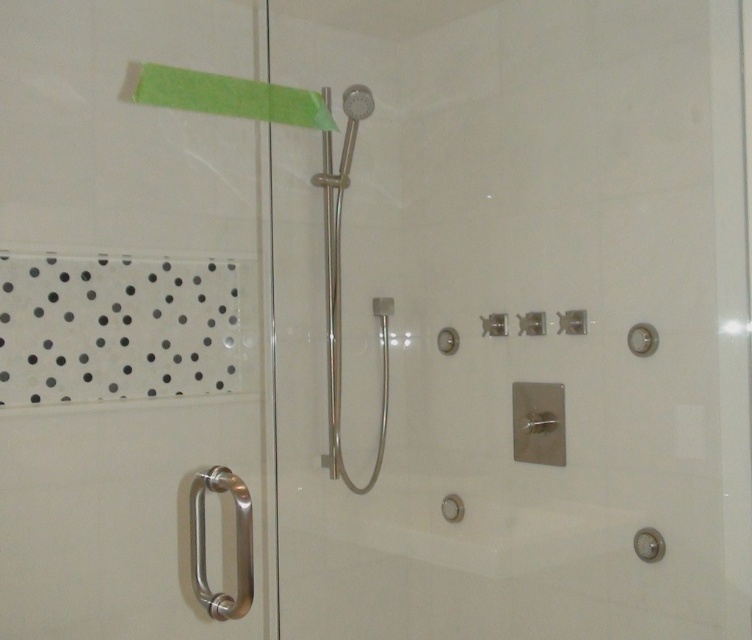
What are the coordinates of `polished chrome shower head at center` in the screenshot? It's located at (340, 307).

Can you confirm if polished chrome shower head at center is taller than satin nickel showerhead at upper center?

Yes, polished chrome shower head at center is taller than satin nickel showerhead at upper center.

Who is more distant from viewer, (326, 177) or (350, 86)?

Point (350, 86)

Identify the location of polished chrome shower head at center. (340, 307).